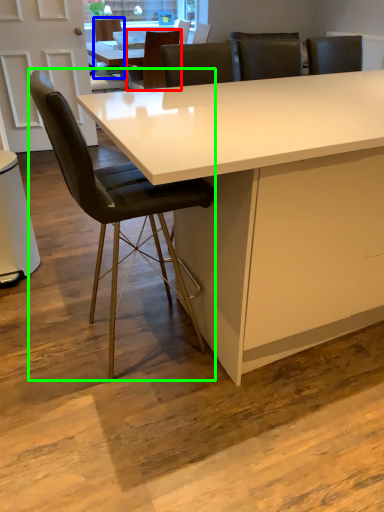
Question: Estimate the real-world distances between objects in this image. Which object is closer to chair (highlighted by a red box), chair (highlighted by a blue box) or chair (highlighted by a green box)?

Choices:
 (A) chair
 (B) chair

Answer: (A)